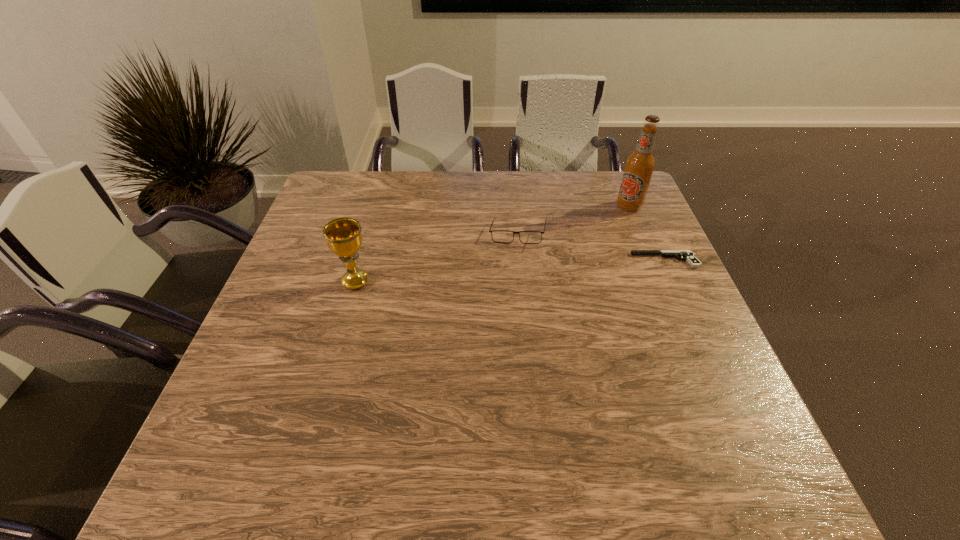
Where is `free space between the beer bottle and the leftmost object`? The height and width of the screenshot is (540, 960). free space between the beer bottle and the leftmost object is located at coordinates (492, 244).

Find the location of a particular element. free spot between the tallest object and the third tallest object is located at coordinates (573, 220).

Locate an element on the screen. free spot between the spectacles and the leftmost object is located at coordinates (437, 258).

In order to click on free area in between the second nearest object and the farthest object in this screenshot , I will do `click(647, 233)`.

The height and width of the screenshot is (540, 960). Find the location of `vacant region between the shortest object and the nearest object`. vacant region between the shortest object and the nearest object is located at coordinates (511, 271).

The image size is (960, 540). In order to click on unoccupied area between the leftmost object and the second farthest object in this screenshot , I will do `click(437, 258)`.

Locate an element on the screen. The width and height of the screenshot is (960, 540). unoccupied area between the nearest object and the tallest object is located at coordinates (492, 244).

Select which object appears as the third closest to the beer bottle. Please provide its 2D coordinates. Your answer should be formatted as a tuple, i.e. [(x, y)], where the tuple contains the x and y coordinates of a point satisfying the conditions above.

[(343, 236)]

Image resolution: width=960 pixels, height=540 pixels. Identify the location of the third closest object to the third nearest object. (343, 236).

Locate an element on the screen. The width and height of the screenshot is (960, 540). vacant point that satisfies the following two spatial constraints: 1. on the front side of the shortest object; 2. on the front-facing side of the beer bottle is located at coordinates (652, 260).